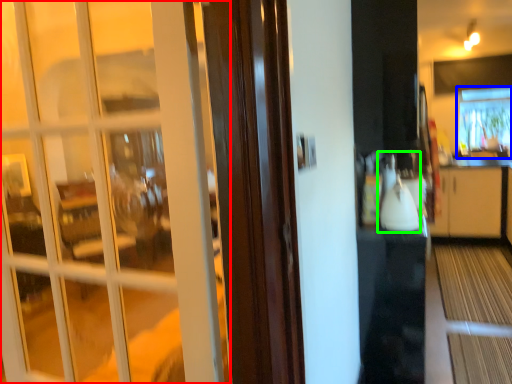
Question: Which is farther away from door (highlighted by a red box)? window (highlighted by a blue box) or appliance (highlighted by a green box)?

Choices:
 (A) window
 (B) appliance

Answer: (A)